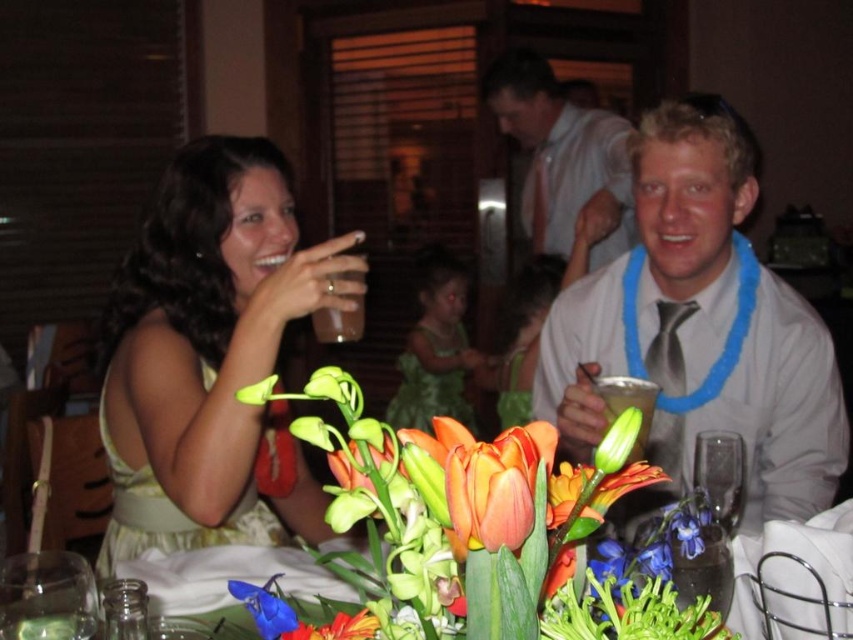
Can you confirm if matte yellow dress at left is positioned to the left of orange matte tulip at center?

Yes, matte yellow dress at left is to the left of orange matte tulip at center.

Which of these two, matte yellow dress at left or orange matte tulip at center, stands shorter?

Standing shorter between the two is orange matte tulip at center.

This screenshot has height=640, width=853. What do you see at coordinates (209, 356) in the screenshot? I see `matte yellow dress at left` at bounding box center [209, 356].

Locate an element on the screen. The height and width of the screenshot is (640, 853). matte yellow dress at left is located at coordinates (209, 356).

Between matte yellow dress at left and clear glass at lower left, which one appears on the right side from the viewer's perspective?

clear glass at lower left

Can you confirm if matte yellow dress at left is wider than clear glass at lower left?

Yes.

Between point (309, 301) and point (68, 637), which one is positioned in front?

Positioned in front is point (68, 637).

You are a GUI agent. You are given a task and a screenshot of the screen. Output one action in this format:
    pyautogui.click(x=<x>, y=<y>)
    Task: Click on the matte yellow dress at left
    This screenshot has width=853, height=640.
    Given the screenshot: What is the action you would take?
    pyautogui.click(x=209, y=356)

Consider the image. Can you confirm if silver metallic shirt at center is smaller than translucent plastic cup at center?

Actually, silver metallic shirt at center might be larger than translucent plastic cup at center.

Looking at this image, who is shorter, silver metallic shirt at center or translucent plastic cup at center?

translucent plastic cup at center

Is point (704, 403) closer to camera compared to point (610, 387)?

No, it is behind (610, 387).

The image size is (853, 640). I want to click on silver metallic shirt at center, so pos(700,326).